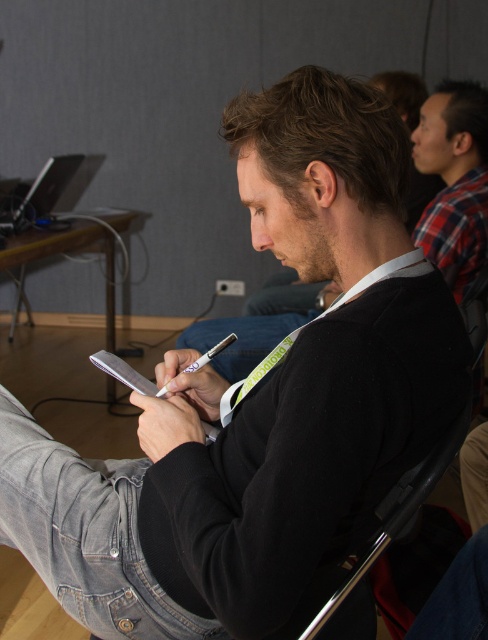
This screenshot has width=488, height=640. What do you see at coordinates (453, 180) in the screenshot?
I see `black matte jacket at center` at bounding box center [453, 180].

Who is more distant from viewer, (220, 336) or (438, 166)?

Positioned behind is point (438, 166).

Identify the location of black matte jacket at center. This screenshot has width=488, height=640. (453, 180).